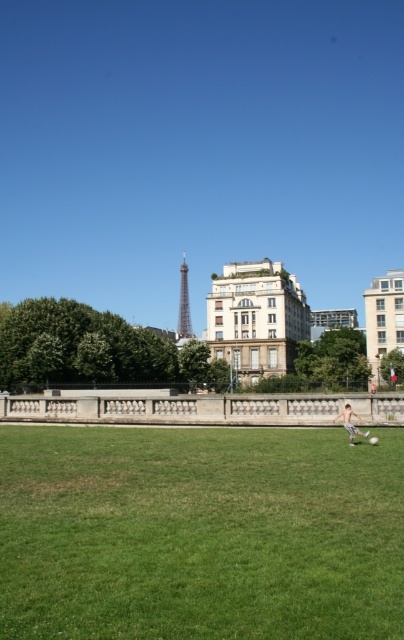
You are a photographer trying to capture the metallic silver tower at center and the skinny white boy at lower right in the same frame. Based on their positions, which object should you focus on first to ensure both are in the shot?

The metallic silver tower at center is above the skinny white boy at lower right, so you should focus on the metallic silver tower at center first to ensure both are in the shot.

You are a drone operator tasked with capturing aerial footage of the soccer field. You notice a specific coordinate point marked as point (199, 532). What is the location of this point relative to the soccer field?

The point (199, 532) corresponds to the green grass at lower center, which is the soccer field itself.